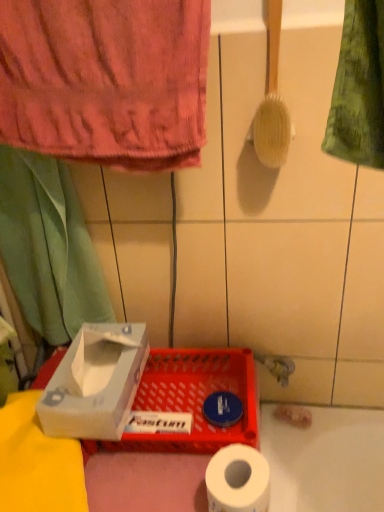
Question: In the image, is green fabric curtain at left on the left side or the right side of white cardboard box at lower left?

Choices:
 (A) left
 (B) right

Answer: (A)

Question: Looking at their shapes, would you say green fabric curtain at left is wider or thinner than white cardboard box at lower left?

Choices:
 (A) thin
 (B) wide

Answer: (A)

Question: Based on their relative distances, which object is farther from the white cardboard box at lower left?

Choices:
 (A) green fabric curtain at left
 (B) pink cotton towel at upper left
 (C) white matte toilet paper at lower center
 (D) matte plastic basket at lower center
 (E) wooden bristles brush at upper right

Answer: (E)

Question: Estimate the real-world distances between objects in this image. Which object is farther from the white matte toilet paper at lower center?

Choices:
 (A) matte plastic basket at lower center
 (B) wooden bristles brush at upper right
 (C) pink cotton towel at upper left
 (D) white cardboard box at lower left
 (E) green fabric curtain at left

Answer: (C)